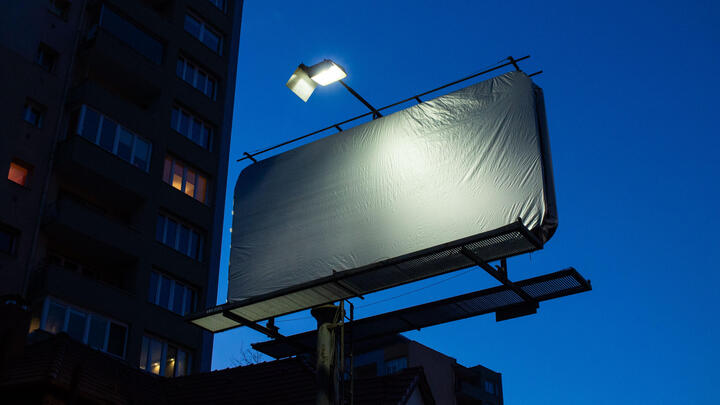
Find the location of `dark window`. dark window is located at coordinates (85, 324), (174, 288), (179, 246), (96, 138), (201, 139), (197, 85), (193, 35), (144, 46).